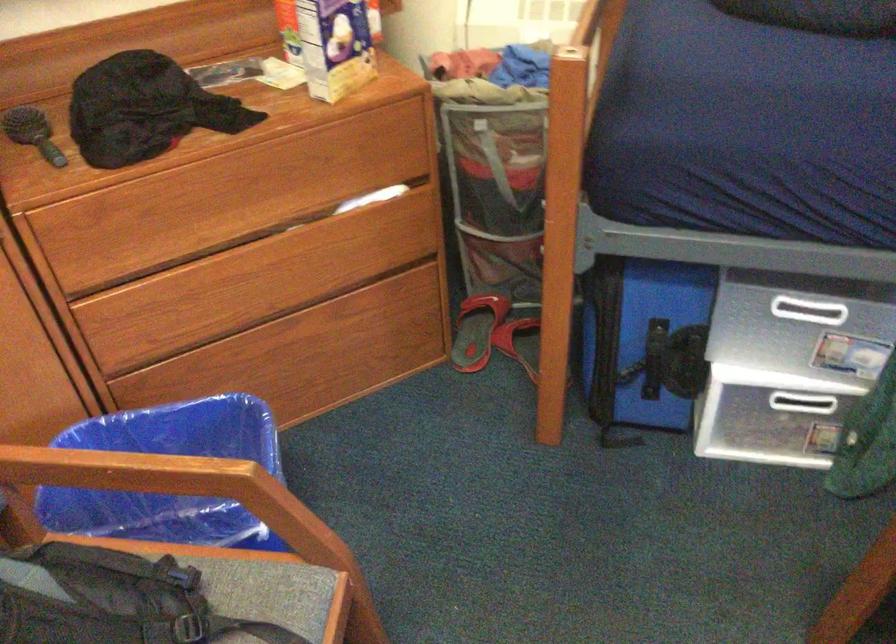
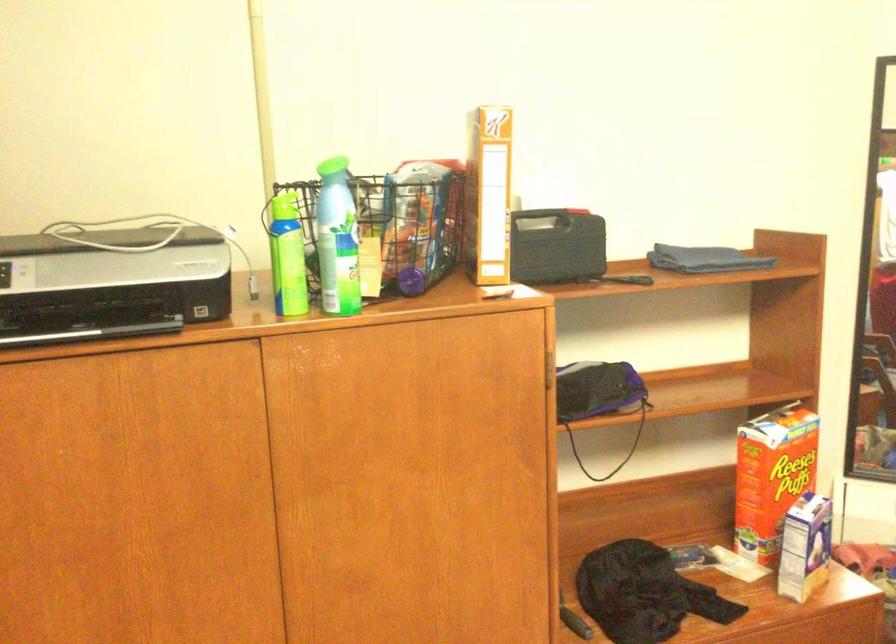
Question: The images are taken continuously from a first-person perspective. In which direction is your viewpoint rotating?

Choices:
 (A) Left
 (B) Right
 (C) Up
 (D) Down

Answer: (C)